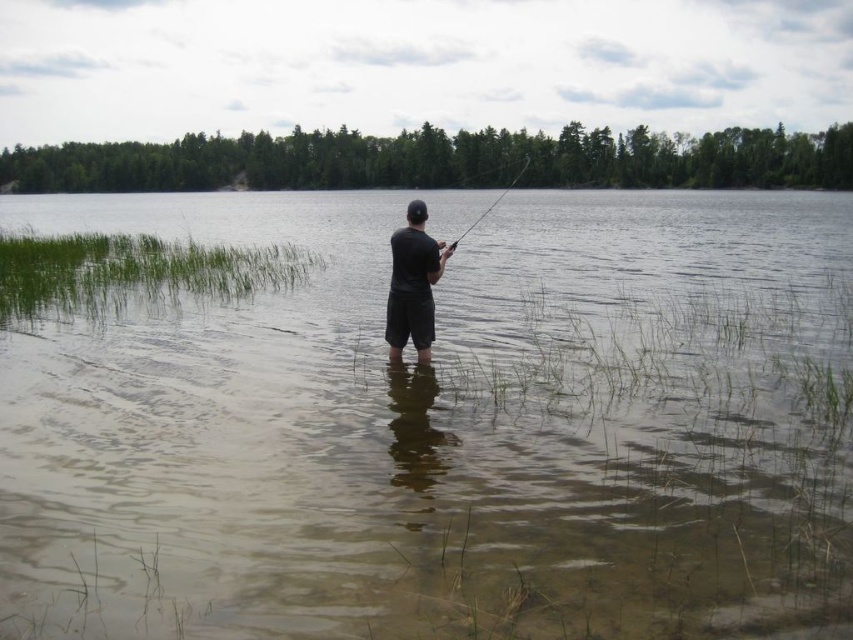
Can you confirm if black matte shorts at center is positioned to the right of smooth black rod at center?

In fact, black matte shorts at center is to the left of smooth black rod at center.

Is point (426, 244) farther from camera compared to point (514, 186)?

No.

This screenshot has height=640, width=853. Identify the location of black matte shorts at center. (413, 284).

Based on the photo, measure the distance between brown murky water at center and smooth black rod at center.

brown murky water at center and smooth black rod at center are 11.45 meters apart from each other.

Can you confirm if brown murky water at center is positioned to the right of smooth black rod at center?

Correct, you'll find brown murky water at center to the right of smooth black rod at center.

Is point (738, 438) farther from viewer compared to point (479, 216)?

No, it is not.

The image size is (853, 640). Identify the location of brown murky water at center. (444, 429).

Can you confirm if brown murky water at center is bigger than black matte shorts at center?

Yes, brown murky water at center is bigger than black matte shorts at center.

Which is more to the right, brown murky water at center or black matte shorts at center?

brown murky water at center

Does point (593, 193) come closer to viewer compared to point (427, 307)?

No, it is behind (427, 307).

Find the location of a particular element. Image resolution: width=853 pixels, height=640 pixels. brown murky water at center is located at coordinates (444, 429).